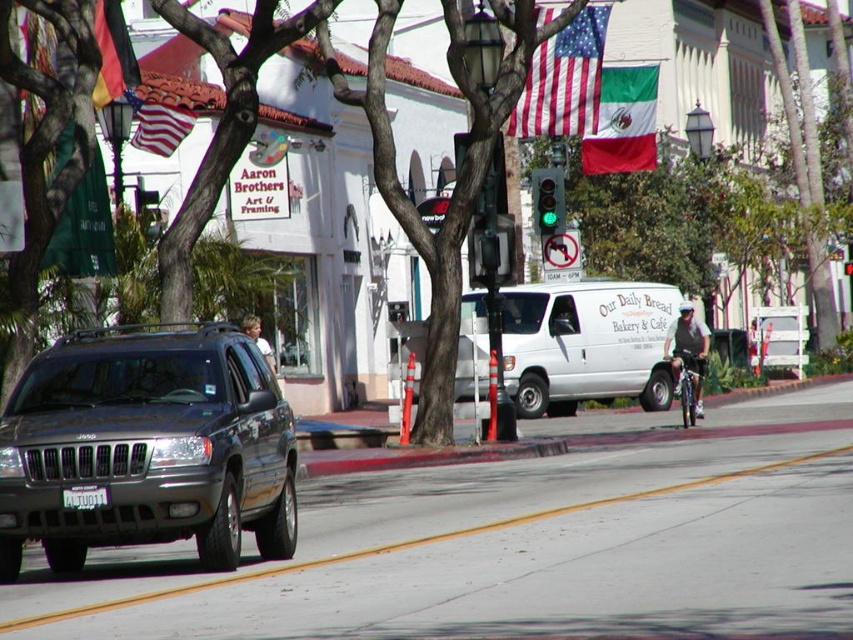
Question: Is red fabric flag at upper left to the right of green glass traffic light at center from the viewer's perspective?

Choices:
 (A) yes
 (B) no

Answer: (B)

Question: Can you confirm if metallic gray suv at left is positioned above american flag at upper center?

Choices:
 (A) yes
 (B) no

Answer: (B)

Question: Which of the following is the farthest from the observer?

Choices:
 (A) metallic gray suv at left
 (B) american flag at upper left

Answer: (B)

Question: Which object is farther from the camera taking this photo?

Choices:
 (A) gray fabric bicycle at center-right
 (B) american flag at upper center
 (C) red fabric flag at upper left

Answer: (B)

Question: Where is red fabric flag at upper left located in relation to white plastic license plate at center in the image?

Choices:
 (A) above
 (B) below

Answer: (A)

Question: Among these objects, which one is nearest to the camera?

Choices:
 (A) american flag at upper left
 (B) american flag at upper center
 (C) white plastic license plate at center

Answer: (C)